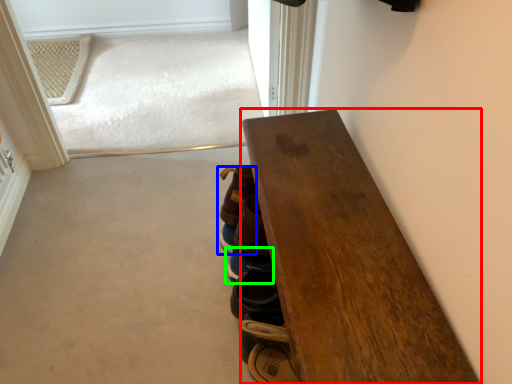
Question: Which object is the farthest from table (highlighted by a red box)? Choose among these: footwear (highlighted by a blue box) or footwear (highlighted by a green box).

Choices:
 (A) footwear
 (B) footwear

Answer: (B)